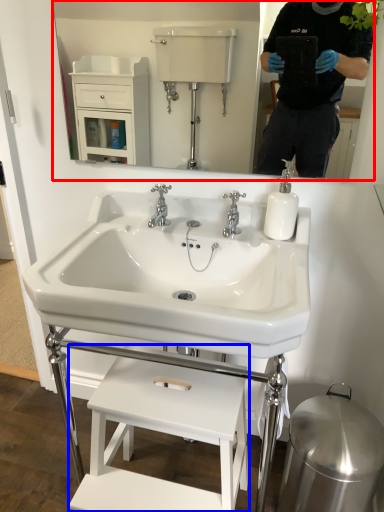
Question: Which object appears farthest to the camera in this image, mirror (highlighted by a red box) or furniture (highlighted by a blue box)?

Choices:
 (A) mirror
 (B) furniture

Answer: (A)